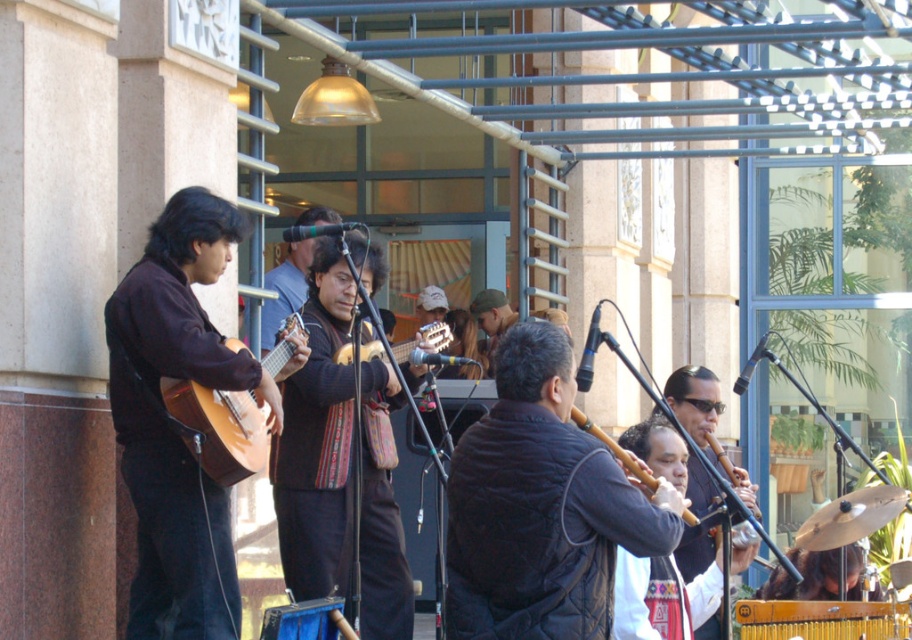
You are a photographer standing at the center of the scene. You want to take a photo that includes both the point at (152, 364) and the point at (382, 525). Which point should you focus on to ensure both are in sharp focus?

You should focus on the point at (382, 525) because it is farther from the camera than the point at (152, 364). By focusing on the farther point, the closer point will also be within the depth of field, ensuring both are in sharp focus.

You are a photographer trying to capture a group photo of the performers. You notice the knitted sweater at center and the light brown wood guitar at left. Based on their positions, which object might block the view of the other when framing the shot?

The knitted sweater at center might block the view of the light brown wood guitar at left since it is wider than the guitar.

You are a photographer at the event and want to capture both the matte brown guitar at left and the knitted sweater at center in a single frame. Given their sizes, which object should you position closer to the camera to ensure both appear balanced in the photo?

The matte brown guitar at left is smaller than the knitted sweater at center. To balance their sizes in the photo, position the matte brown guitar at left closer to the camera and the knitted sweater at center slightly farther back.